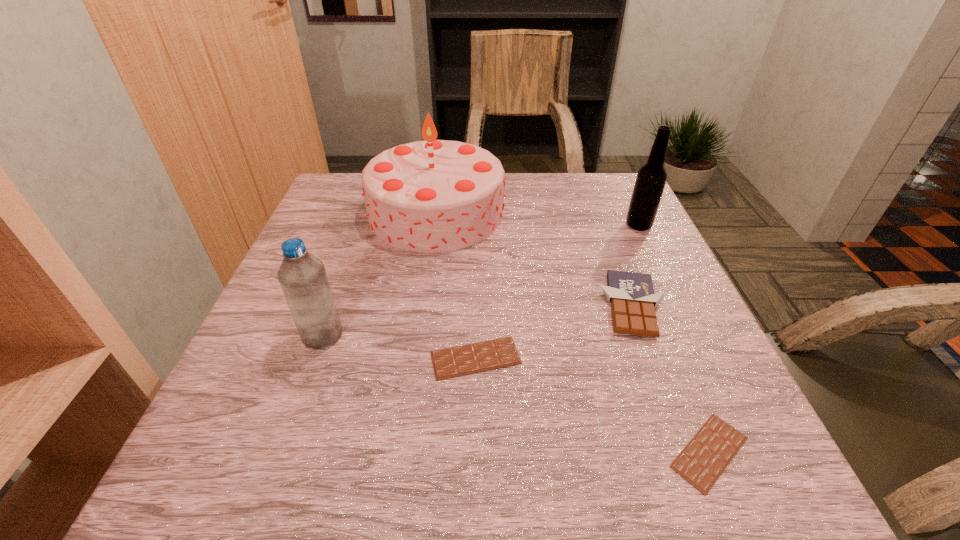
Locate an element on the screen. The width and height of the screenshot is (960, 540). object at the far right corner is located at coordinates (651, 178).

You are a GUI agent. You are given a task and a screenshot of the screen. Output one action in this format:
    pyautogui.click(x=<x>, y=<y>)
    Task: Click on the object located in the near right corner section of the desktop
    Image resolution: width=960 pixels, height=540 pixels.
    Given the screenshot: What is the action you would take?
    pyautogui.click(x=703, y=460)

You are a GUI agent. You are given a task and a screenshot of the screen. Output one action in this format:
    pyautogui.click(x=<x>, y=<y>)
    Task: Click on the free space at the far edge of the desktop
    This screenshot has height=540, width=960.
    Given the screenshot: What is the action you would take?
    pyautogui.click(x=569, y=204)

Locate an element on the screen. vacant area at the left edge is located at coordinates (297, 410).

You are a GUI agent. You are given a task and a screenshot of the screen. Output one action in this format:
    pyautogui.click(x=<x>, y=<y>)
    Task: Click on the vacant space at the right edge of the desktop
    The height and width of the screenshot is (540, 960).
    Given the screenshot: What is the action you would take?
    tap(616, 232)

Where is `vacant point at the far left corner`? vacant point at the far left corner is located at coordinates tap(355, 201).

The height and width of the screenshot is (540, 960). Find the location of `free location at the far right corner of the desktop`. free location at the far right corner of the desktop is located at coordinates [x=616, y=180].

The image size is (960, 540). Find the location of `vacant space that is in between the water bottle and the beer bottle`. vacant space that is in between the water bottle and the beer bottle is located at coordinates (481, 280).

Identify the location of unoccupied area between the fourth tallest object and the shortest object. The height and width of the screenshot is (540, 960). (671, 379).

Locate an element on the screen. vacant point located between the beer bottle and the leftmost chocolate bar is located at coordinates (557, 292).